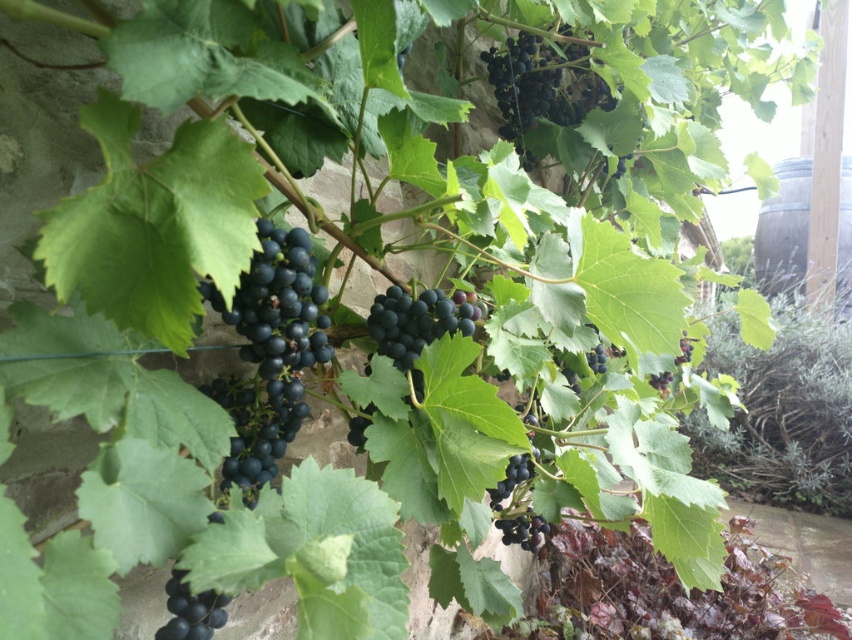
Based on the photo, is shiny dark blue grapes at center taller than shiny dark purple grapes at center-right?

No, shiny dark blue grapes at center is not taller than shiny dark purple grapes at center-right.

How far apart are shiny dark blue grapes at center and shiny dark purple grapes at center-right?

A distance of 1.21 meters exists between shiny dark blue grapes at center and shiny dark purple grapes at center-right.

The image size is (852, 640). Identify the location of shiny dark blue grapes at center. (417, 321).

Is dark purple grapes at upper center bigger than black matte grapes at lower left?

Yes.

Between dark purple grapes at upper center and black matte grapes at lower left, which one is positioned higher?

Positioned higher is dark purple grapes at upper center.

Where is `dark purple grapes at upper center`? The height and width of the screenshot is (640, 852). dark purple grapes at upper center is located at coordinates (540, 86).

Locate an element on the screen. The image size is (852, 640). dark purple grapes at upper center is located at coordinates (540, 86).

Is point (571, 64) closer to viewer compared to point (668, 385)?

Yes, it is in front of point (668, 385).

Based on the photo, measure the distance from dark purple grapes at upper center to shiny dark purple grapes at center-right.

dark purple grapes at upper center is 29.18 inches away from shiny dark purple grapes at center-right.

Is point (528, 56) in front of point (680, 356)?

Yes, it is in front of point (680, 356).

The width and height of the screenshot is (852, 640). In order to click on dark purple grapes at upper center in this screenshot , I will do `click(540, 86)`.